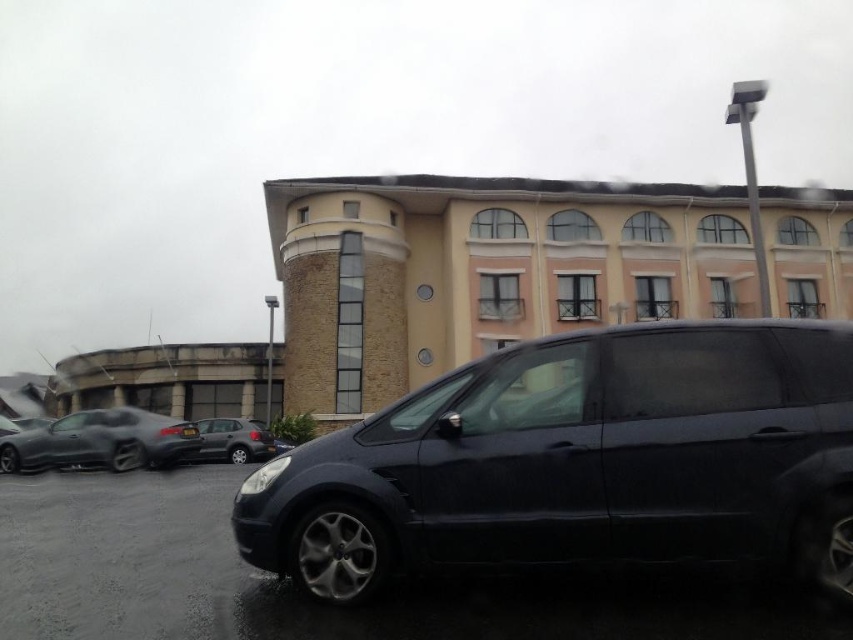
Looking at this image, does satin black minivan at center have a greater width compared to satin silver hatchback at center?

Yes, satin black minivan at center is wider than satin silver hatchback at center.

From the picture: Is satin black minivan at center below satin silver hatchback at center?

No, satin black minivan at center is not below satin silver hatchback at center.

Between point (804, 364) and point (201, 445), which one is positioned behind?

Positioned behind is point (201, 445).

In order to click on satin black minivan at center in this screenshot , I will do `click(579, 461)`.

Is glossy dark blue car at lower center positioned before shiny black car at left?

That is True.

This screenshot has height=640, width=853. Identify the location of glossy dark blue car at lower center. (297, 593).

Locate an element on the screen. The height and width of the screenshot is (640, 853). glossy dark blue car at lower center is located at coordinates (297, 593).

This screenshot has width=853, height=640. In order to click on glossy dark blue car at lower center in this screenshot , I will do `click(297, 593)`.

Based on the photo, is the position of satin black minivan at center more distant than that of shiny black car at left?

No.

Does point (465, 486) come farther from viewer compared to point (138, 456)?

No, it is not.

Image resolution: width=853 pixels, height=640 pixels. Identify the location of satin black minivan at center. (579, 461).